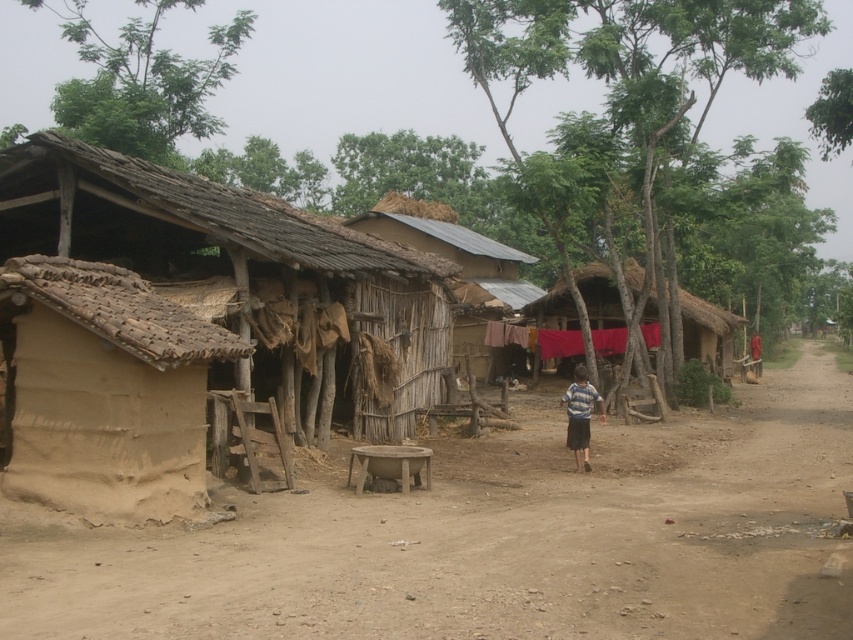
You are standing in the rural village scene and notice a brown dirt field at center and a striped fabric shirt at center. Which object is located below the other?

The brown dirt field at center is positioned under striped fabric shirt at center, so the dirt field is below the shirt.

You are standing at the point labeled as point (491, 538) in the rural village scene. What type of terrain are you currently standing on?

The point (491, 538) indicates a brown dirt field at center, so you are standing on a dirt field.

You are standing at the entrance of the village and see the point marked at coordinates (459, 264). What does this point represent in the scene?

The point at coordinates (459, 264) represents the thatched wood hut at center.